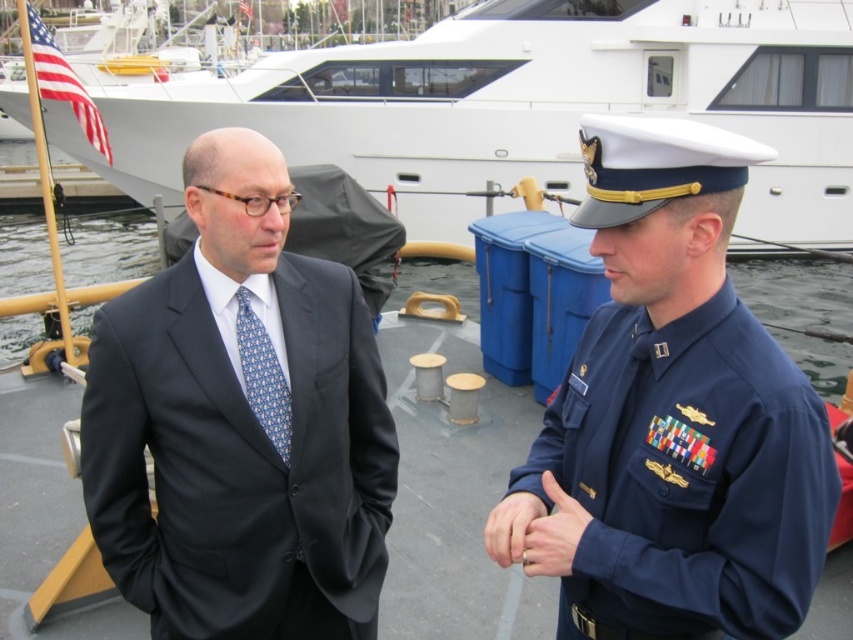
Consider the image. Is matte black suit at center in front of white glossy yacht at upper center?

Yes, it is.

Between matte black suit at center and white glossy yacht at upper center, which one has less height?

With less height is matte black suit at center.

Who is more distant from viewer, (225, 628) or (730, 36)?

The point (730, 36) is more distant.

You are a GUI agent. You are given a task and a screenshot of the screen. Output one action in this format:
    pyautogui.click(x=<x>, y=<y>)
    Task: Click on the matte black suit at center
    
    Given the screenshot: What is the action you would take?
    pyautogui.click(x=241, y=422)

Which is below, navy blue uniform at center or smooth skin hand at center?

smooth skin hand at center is lower down.

Can you confirm if navy blue uniform at center is wider than smooth skin hand at center?

Indeed, navy blue uniform at center has a greater width compared to smooth skin hand at center.

Is point (721, 588) behind point (560, 502)?

That is False.

In order to click on navy blue uniform at center in this screenshot , I will do `click(676, 412)`.

Is blue printed silk tie at center wider than smooth skin hand at center?

No, blue printed silk tie at center is not wider than smooth skin hand at center.

This screenshot has width=853, height=640. Find the location of `blue printed silk tie at center`. blue printed silk tie at center is located at coordinates (262, 376).

This screenshot has height=640, width=853. What are the coordinates of `blue printed silk tie at center` in the screenshot? It's located at (262, 376).